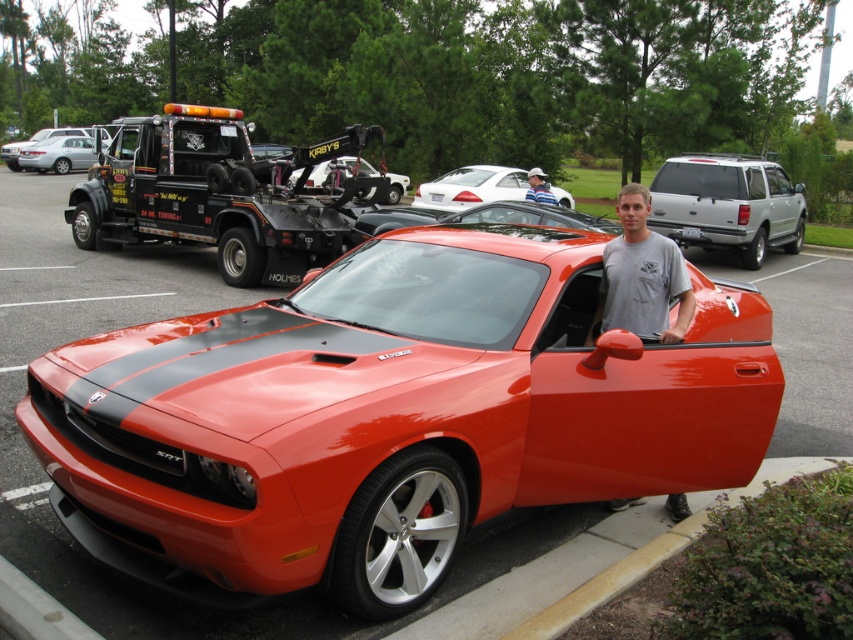
Question: Which object is positioned farthest from the white glossy sedan at upper center?

Choices:
 (A) metallic silver sedan at center
 (B) satin silver suv at right
 (C) striped fabric cap at upper center
 (D) gray cotton t-shirt at center

Answer: (A)

Question: Does white glossy sedan at upper center have a larger size compared to metallic silver car at center?

Choices:
 (A) no
 (B) yes

Answer: (A)

Question: Which point is closer to the camera?

Choices:
 (A) metallic silver sedan at center
 (B) white plastic license plate at center
 (C) striped fabric cap at upper center
 (D) shiny orange car at center

Answer: (D)

Question: Can you confirm if satin silver suv at right is positioned to the left of gray cotton t-shirt at center?

Choices:
 (A) no
 (B) yes

Answer: (A)

Question: Which point appears farthest from the camera in this image?

Choices:
 (A) (254, 468)
 (B) (483, 182)
 (C) (670, 209)

Answer: (B)

Question: Can you confirm if black matte tow truck at left is thinner than metallic silver car at center?

Choices:
 (A) no
 (B) yes

Answer: (A)